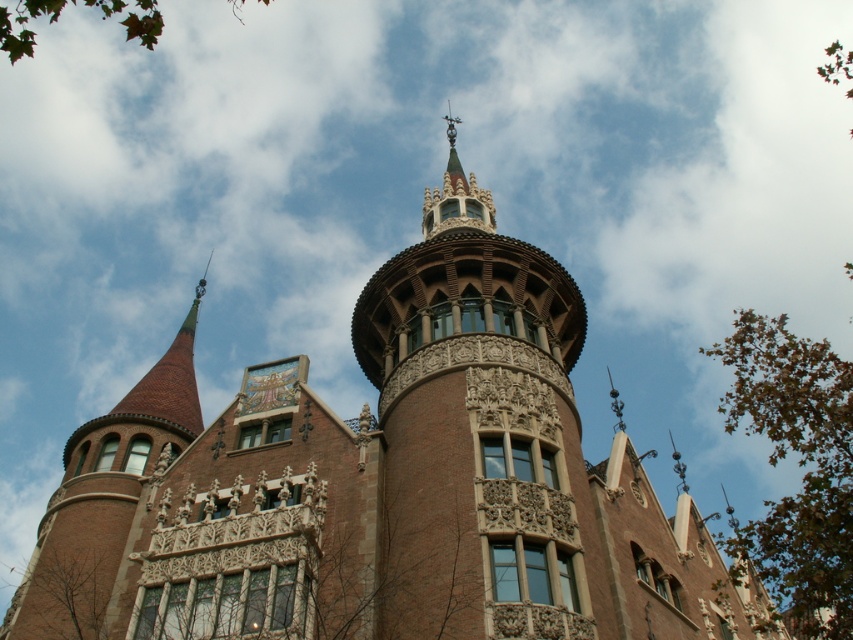
Who is more distant from viewer, [51,636] or [107,4]?

Point [107,4]

Is point (73, 589) positioned after point (7, 42)?

Yes, it is.

Does point (21, 582) lie in front of point (129, 24)?

No, (21, 582) is further to viewer.

Where is `brown textured tree at lower left`? The image size is (853, 640). brown textured tree at lower left is located at coordinates (62, 593).

Looking at this image, can you confirm if green leafy tree at right is wider than brown textured tree at lower left?

Yes, green leafy tree at right is wider than brown textured tree at lower left.

Is point (804, 588) farther from viewer compared to point (71, 637)?

No, (804, 588) is closer to viewer.

Where is `green leafy tree at right`? This screenshot has height=640, width=853. green leafy tree at right is located at coordinates click(x=799, y=465).

Can you confirm if green leafy tree at right is positioned to the left of green leafy tree at upper left?

In fact, green leafy tree at right is to the right of green leafy tree at upper left.

Is green leafy tree at right taller than green leafy tree at upper left?

No, green leafy tree at right is not taller than green leafy tree at upper left.

Which is in front, point (808, 442) or point (9, 32)?

Point (808, 442)

The image size is (853, 640). In order to click on green leafy tree at right in this screenshot , I will do [x=799, y=465].